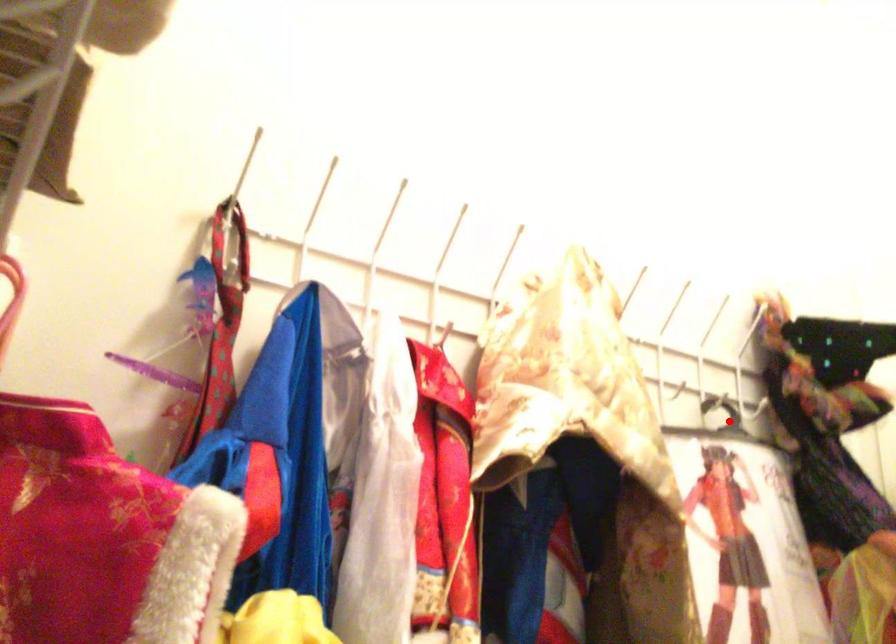
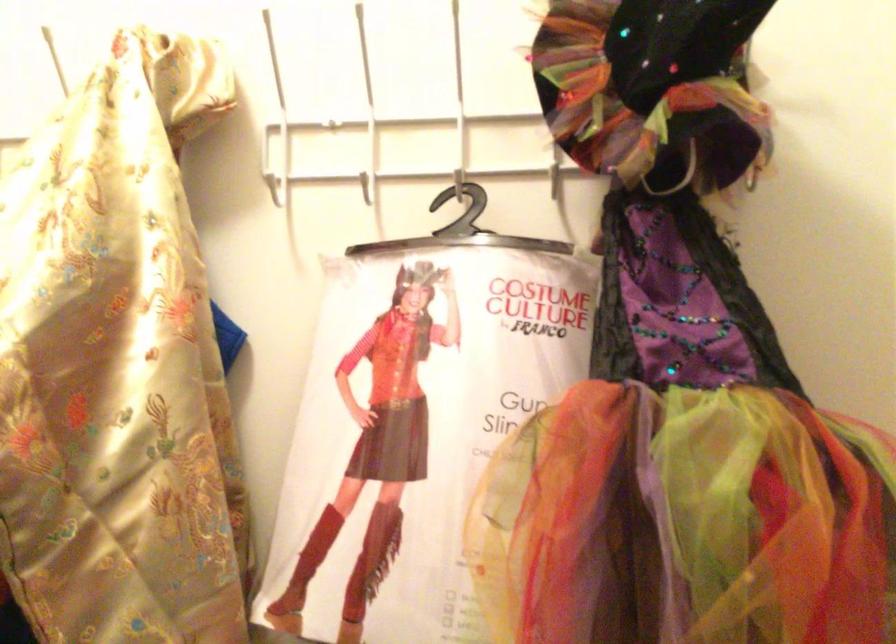
In the second image, find the point that corresponds to the highlighted location in the first image.

(461, 230)